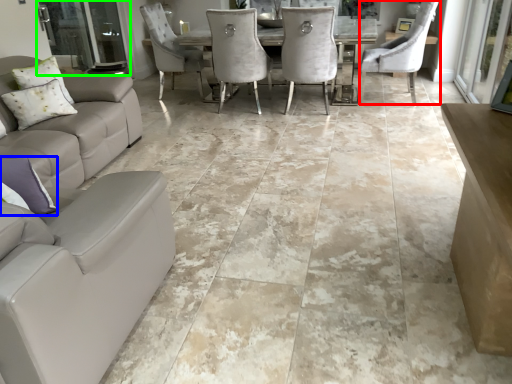
Question: Estimate the real-world distances between objects in this image. Which object is closer to chair (highlighted by a red box), pillow (highlighted by a blue box) or screen door (highlighted by a green box)?

Choices:
 (A) pillow
 (B) screen door

Answer: (B)